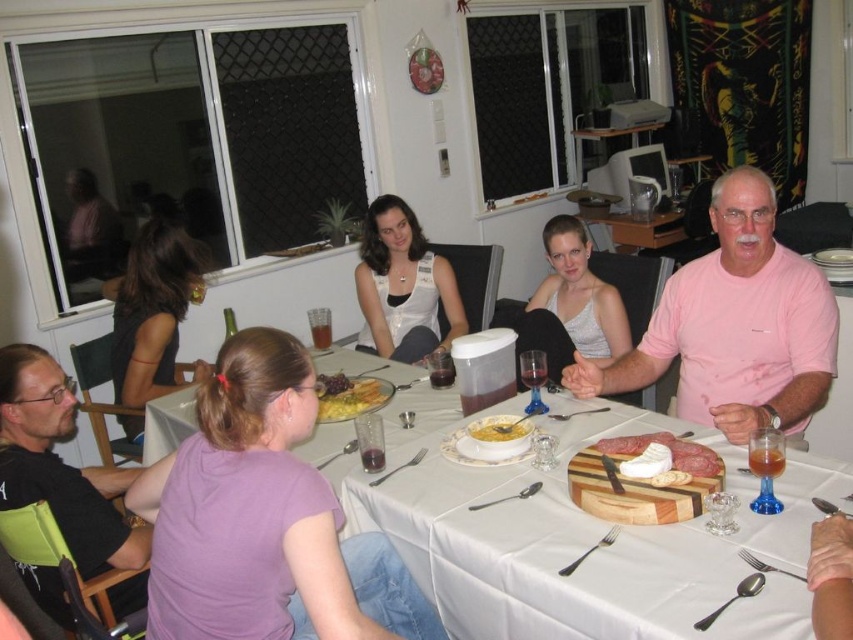
You are a guest at this dinner and want to pass the wooden cutting board with meat and cheese at center to the person wearing the pink cotton shirt at upper right. Can you directly hand it to them without moving the board?

The pink cotton shirt at upper right is positioned on the right side of wooden cutting board with meat and cheese at center, so the board is already on the left side of the shirt wearer. To hand it directly, you would need to move the board to their right side.

You are a photographer taking a picture of the dining table. You need to focus on the pink cotton shirt at upper right and the smooth white cheese at center. Which object should you adjust your camera to the right to capture better?

The pink cotton shirt at upper right is to the right of smooth white cheese at center, so to capture the pink cotton shirt at upper right better, adjust the camera to the right from the smooth white cheese at center.